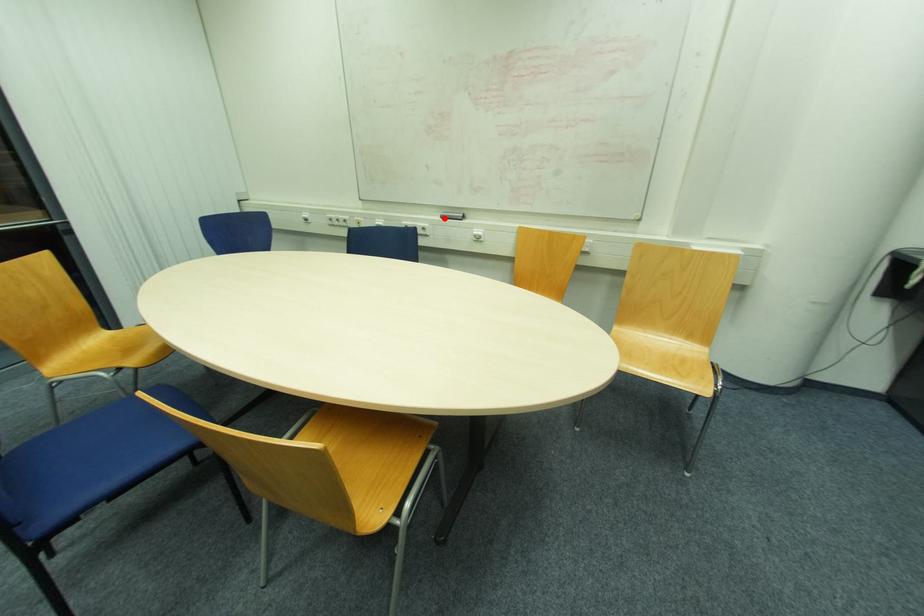
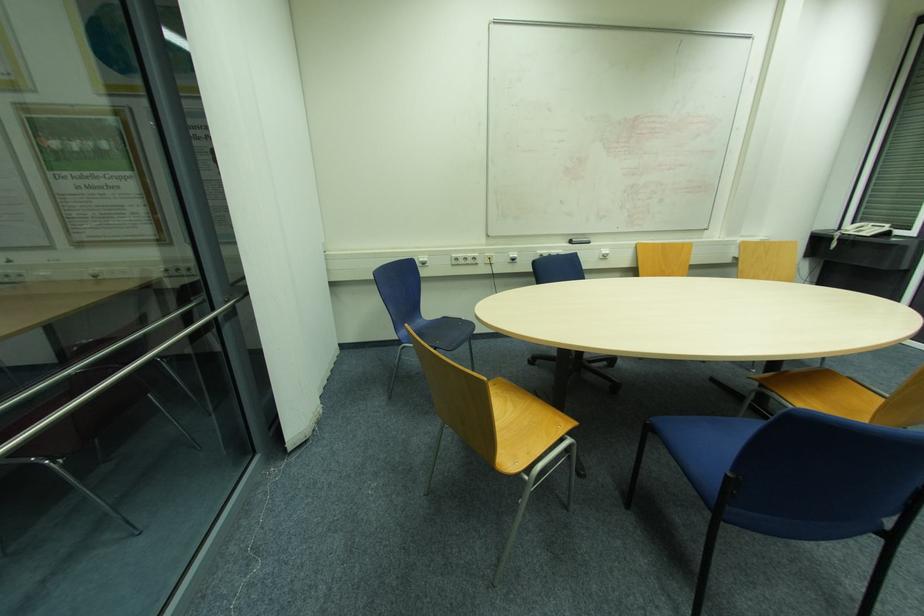
The point at the highlighted location is marked in the first image. Where is the corresponding point in the second image?

(574, 244)